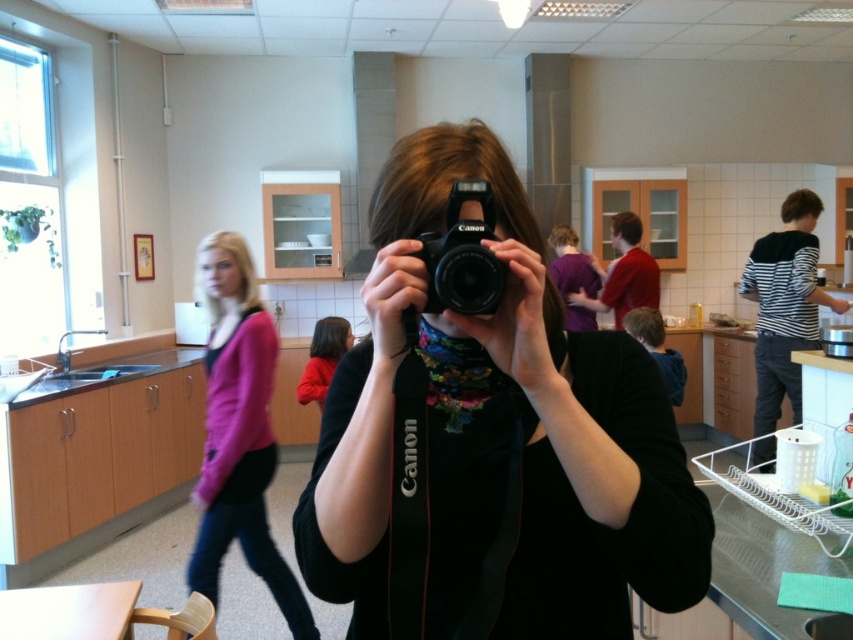
You are the person holding the Canon camera. You notice two points in the background, point A at coordinates point (543, 548) and point B at coordinates point (482, 273). Which point is closer to you when you look through the camera viewfinder?

Point A at coordinates point (543, 548) is closer to you because it is further to the viewer than point B at coordinates point (482, 273).

You are a photographer trying to position your black matte camera at center for a group photo. Based on the scene, where exactly is the camera placed in relation to the other elements?

The black matte camera at center is located at point coordinates 0.694 on the x axis and 0.578 on the y axis.

You are standing in the kitchen and want to take a photo of the black matte camera at center and the pink sweater at center. Which object should you focus on first if you want both to be in sharp focus?

The black matte camera at center is closer to the viewer than the pink sweater at center. To have both in sharp focus, focus on the black matte camera at center first, as it is closer, and use a smaller aperture to increase depth of field.